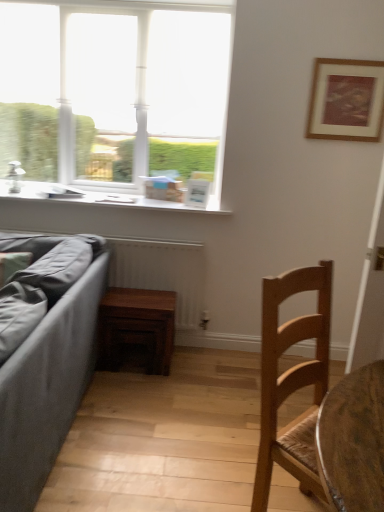
Question: Looking at their shapes, would you say white glass window at upper left is wider or thinner than wooden chair at lower right?

Choices:
 (A) thin
 (B) wide

Answer: (A)

Question: Based on their sizes in the image, would you say white glass window at upper left is bigger or smaller than wooden chair at lower right?

Choices:
 (A) big
 (B) small

Answer: (A)

Question: Considering the real-world distances, which object is closest to the white glass window at upper left?

Choices:
 (A) dark wood table at center
 (B) wooden chair at lower right
 (C) wooden radiator at lower left
 (D) white glossy window sill at upper left
 (E) wooden framed artwork at upper right

Answer: (D)

Question: Which object is the farthest from the wooden radiator at lower left?

Choices:
 (A) wooden framed artwork at upper right
 (B) dark wood table at center
 (C) wooden chair at lower right
 (D) white glossy window sill at upper left
 (E) white glass window at upper left

Answer: (C)